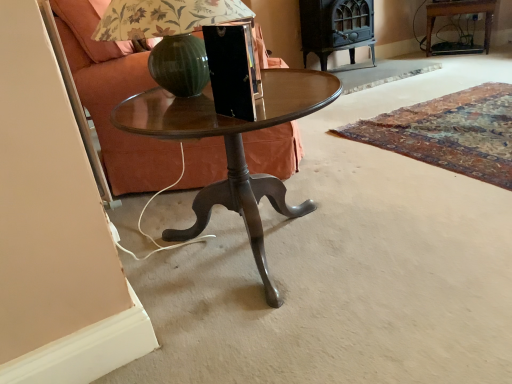
At what (x,y) coordinates should I click in order to perform the action: click on blank area beneath wooden glossy table at center (from a real-world perspective). Please return your answer as a coordinate pair (x, y). Looking at the image, I should click on (249, 256).